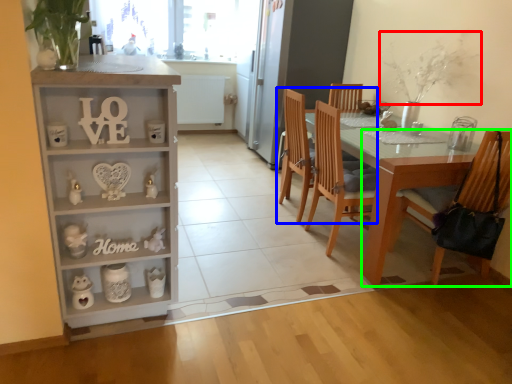
Question: Which object is positioned closest to plant (highlighted by a red box)? Select from chair (highlighted by a blue box) and chair (highlighted by a green box).

Choices:
 (A) chair
 (B) chair

Answer: (A)